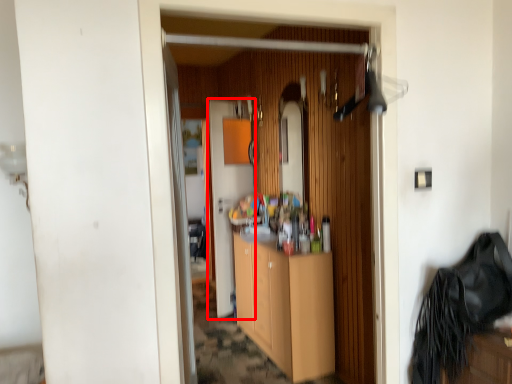
Question: From the image's perspective, where is door (annotated by the red box) located relative to cabinetry?

Choices:
 (A) below
 (B) above

Answer: (B)